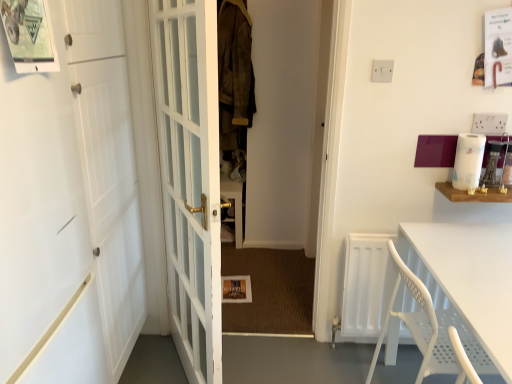
Question: Are white plastic table at lower right and white matte door at left, placed as the second door when sorted from right to left, beside each other?

Choices:
 (A) no
 (B) yes

Answer: (A)

Question: Is white plastic table at lower right outside white matte door at left, marked as the 1th door in a left-to-right arrangement?

Choices:
 (A) no
 (B) yes

Answer: (B)

Question: Does white plastic table at lower right have a lesser width compared to white matte door at left, marked as the 1th door in a left-to-right arrangement?

Choices:
 (A) no
 (B) yes

Answer: (A)

Question: Can you confirm if white plastic table at lower right is bigger than white matte door at left, placed as the second door when sorted from right to left?

Choices:
 (A) no
 (B) yes

Answer: (A)

Question: From the image's perspective, is white plastic table at lower right located above white matte door at left, placed as the second door when sorted from right to left?

Choices:
 (A) no
 (B) yes

Answer: (A)

Question: Considering the positions of point (478, 240) and point (480, 152), is point (478, 240) closer or farther from the camera than point (480, 152)?

Choices:
 (A) closer
 (B) farther

Answer: (A)

Question: Is white plastic table at lower right bigger or smaller than white paper towel at upper right?

Choices:
 (A) small
 (B) big

Answer: (B)

Question: From a real-world perspective, is white plastic table at lower right above or below white paper towel at upper right?

Choices:
 (A) above
 (B) below

Answer: (B)

Question: In terms of height, does white plastic table at lower right look taller or shorter compared to white paper towel at upper right?

Choices:
 (A) tall
 (B) short

Answer: (A)

Question: Is suede jacket at center in front of or behind white glass door at center, placed as the 1th door when sorted from right to left, in the image?

Choices:
 (A) behind
 (B) front

Answer: (A)

Question: Considering the positions of point (246, 122) and point (195, 71), is point (246, 122) closer or farther from the camera than point (195, 71)?

Choices:
 (A) farther
 (B) closer

Answer: (A)

Question: Based on their positions, is suede jacket at center located to the left or right of white glass door at center, acting as the 2th door starting from the left?

Choices:
 (A) right
 (B) left

Answer: (A)

Question: Is suede jacket at center taller or shorter than white glass door at center, acting as the 2th door starting from the left?

Choices:
 (A) short
 (B) tall

Answer: (A)

Question: Considering their positions, is white plastic table at lower right located in front of or behind white matte door at left, marked as the 1th door in a left-to-right arrangement?

Choices:
 (A) front
 (B) behind

Answer: (B)

Question: From a real-world perspective, is white plastic table at lower right physically located above or below white matte door at left, marked as the 1th door in a left-to-right arrangement?

Choices:
 (A) above
 (B) below

Answer: (B)